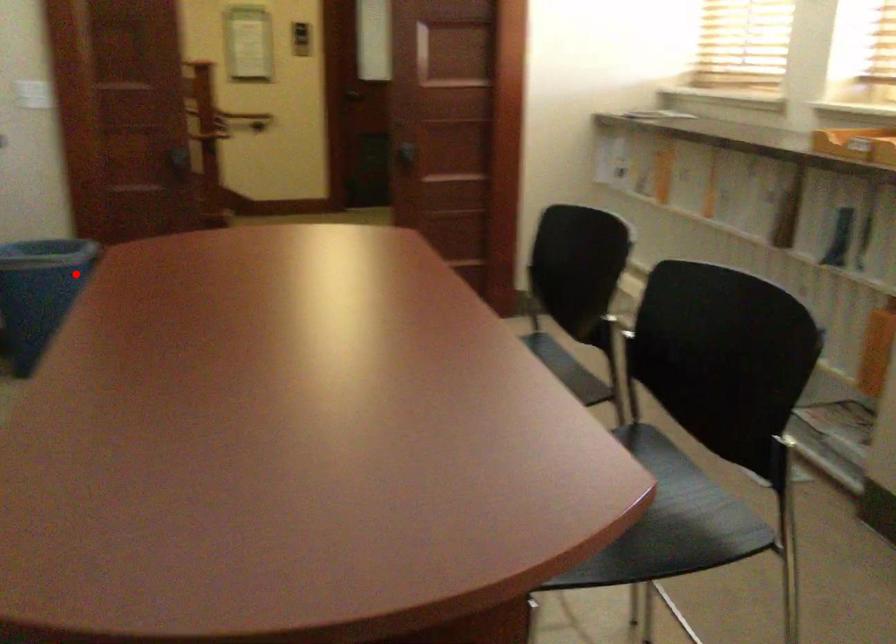
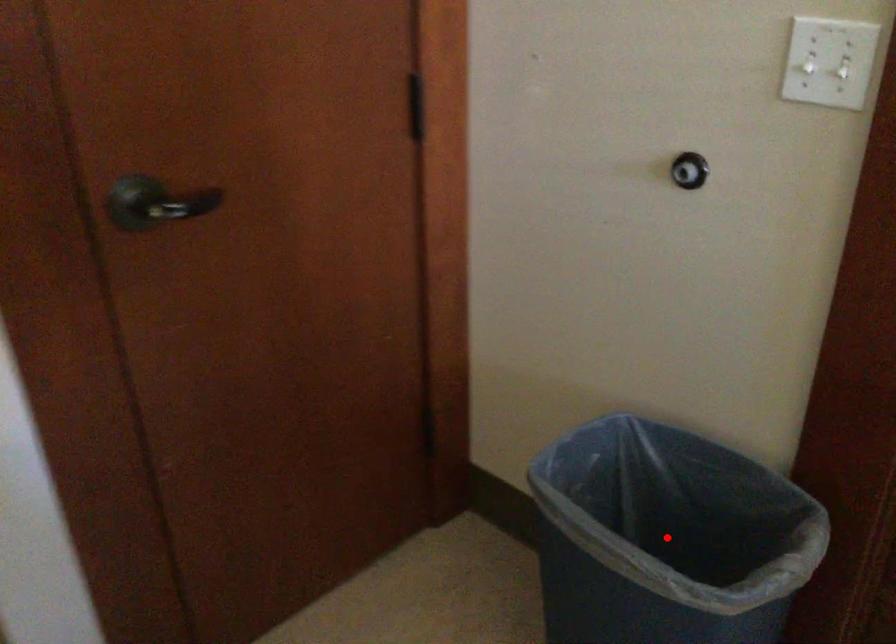
I am providing you with two images of the same scene from different viewpoints. A red point is marked on the first image and another point is marked on the second image. Is the marked point in image1 the same physical position as the marked point in image2?

Yes